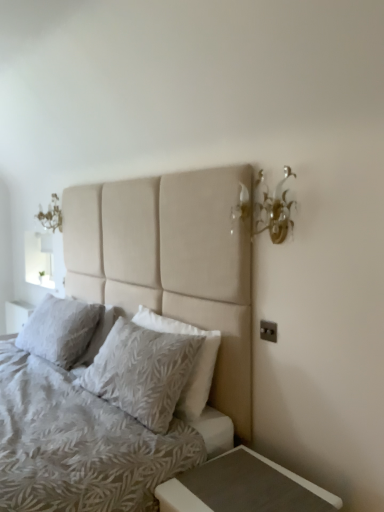
The image size is (384, 512). What do you see at coordinates (171, 263) in the screenshot?
I see `beige fabric bed at center` at bounding box center [171, 263].

Find the location of `beige fabric bed at center`. beige fabric bed at center is located at coordinates (171, 263).

At what (x,y) coordinates should I click in order to perform the action: click on white frosted glass at upper left. Please return your answer as a coordinate pair (x, y). Image resolution: width=384 pixels, height=512 pixels. Looking at the image, I should click on (39, 259).

The height and width of the screenshot is (512, 384). I want to click on white textured pillow at center, acting as the first pillow starting from the left, so click(59, 329).

From a real-world perspective, is matte gray wood nightstand at lower right over matte gray plastic electric outlet at lower right?

No, from a real-world perspective, matte gray wood nightstand at lower right is not over matte gray plastic electric outlet at lower right

Is matte gray wood nightstand at lower right next to matte gray plastic electric outlet at lower right and touching it?

matte gray wood nightstand at lower right is not next to matte gray plastic electric outlet at lower right, and they're not touching.

Consider the image. In the image, is matte gray wood nightstand at lower right on the left side or the right side of matte gray plastic electric outlet at lower right?

matte gray wood nightstand at lower right is positioned on matte gray plastic electric outlet at lower right's left side.

The image size is (384, 512). In order to click on nightstand in front of the matte gray plastic electric outlet at lower right in this screenshot , I will do `click(243, 487)`.

Is matte gray wood nightstand at lower right positioned beyond the bounds of white frosted glass at upper left?

Absolutely, matte gray wood nightstand at lower right is external to white frosted glass at upper left.

Can you confirm if matte gray wood nightstand at lower right is shorter than white frosted glass at upper left?

Indeed, matte gray wood nightstand at lower right has a lesser height compared to white frosted glass at upper left.

I want to click on nightstand on the right of the white frosted glass at upper left, so click(243, 487).

Can you tell me how much matte gray wood nightstand at lower right and white frosted glass at upper left differ in facing direction?

The angular difference between matte gray wood nightstand at lower right and white frosted glass at upper left is 1.22 degrees.

Between gold metallic wall sconce at upper right and white frosted glass at upper left, which one has less height?

gold metallic wall sconce at upper right is shorter.

Which object is positioned more to the left, gold metallic wall sconce at upper right or white frosted glass at upper left?

From the viewer's perspective, white frosted glass at upper left appears more on the left side.

Locate an element on the screen. lamp that is above the white frosted glass at upper left (from a real-world perspective) is located at coordinates (274, 212).

From a real-world perspective, is gold metallic wall sconce at upper right positioned over white frosted glass at upper left based on gravity?

Correct, in the physical world, gold metallic wall sconce at upper right is higher than white frosted glass at upper left.

Is gold metallic wall sconce at upper right not within matte gray plastic electric outlet at lower right?

Indeed, gold metallic wall sconce at upper right is completely outside matte gray plastic electric outlet at lower right.

Is gold metallic wall sconce at upper right positioned far away from matte gray plastic electric outlet at lower right?

No, gold metallic wall sconce at upper right is not far from matte gray plastic electric outlet at lower right.

Looking at this image, from a real-world perspective, is gold metallic wall sconce at upper right located higher than matte gray plastic electric outlet at lower right?

Yes.

Can you confirm if gold metallic wall sconce at upper right is positioned to the right of matte gray plastic electric outlet at lower right?

No.

From the image's perspective, is textured beige pillow at center, placed as the 2th pillow when sorted from left to right, positioned above or below matte gray plastic electric outlet at lower right?

Clearly, from the image's perspective, textured beige pillow at center, placed as the 2th pillow when sorted from left to right, is below matte gray plastic electric outlet at lower right.

Which of these two, textured beige pillow at center, placed as the 2th pillow when sorted from left to right, or matte gray plastic electric outlet at lower right, stands shorter?

With less height is matte gray plastic electric outlet at lower right.

From a real-world perspective, relative to matte gray plastic electric outlet at lower right, is textured beige pillow at center, placed as the 2th pillow when sorted from left to right, vertically above or below?

From a real-world perspective, textured beige pillow at center, placed as the 2th pillow when sorted from left to right, is physically below matte gray plastic electric outlet at lower right.

Is textured beige pillow at center, which appears as the first pillow when viewed from the right, thinner than matte gray plastic electric outlet at lower right?

In fact, textured beige pillow at center, which appears as the first pillow when viewed from the right, might be wider than matte gray plastic electric outlet at lower right.

Is white textured pillow at center, the 2th pillow in the front-to-back sequence, directly adjacent to textured beige pillow at center, which appears as the first pillow when viewed from the right?

white textured pillow at center, the 2th pillow in the front-to-back sequence, and textured beige pillow at center, which appears as the first pillow when viewed from the right, are not in contact.

Is white textured pillow at center, the 2th pillow in the front-to-back sequence, aimed at textured beige pillow at center, which is counted as the first pillow, starting from the front?

No.

Considering the relative sizes of white textured pillow at center, acting as the 1th pillow starting from the back, and textured beige pillow at center, which appears as the first pillow when viewed from the right, in the image provided, is white textured pillow at center, acting as the 1th pillow starting from the back, smaller than textured beige pillow at center, which appears as the first pillow when viewed from the right,?

No.

Is beige fabric bed at center facing towards textured beige pillow at center, marked as the 2th pillow in a back-to-front arrangement?

Yes, beige fabric bed at center faces towards textured beige pillow at center, marked as the 2th pillow in a back-to-front arrangement.

The width and height of the screenshot is (384, 512). I want to click on the 2nd pillow below the beige fabric bed at center (from a real-world perspective), so click(x=142, y=371).

In the scene shown: Can you tell me how much beige fabric bed at center and textured beige pillow at center, which appears as the first pillow when viewed from the right, differ in facing direction?

The angle between the facing direction of beige fabric bed at center and the facing direction of textured beige pillow at center, which appears as the first pillow when viewed from the right, is 1.22 degrees.

From a real-world perspective, between beige fabric bed at center and textured beige pillow at center, placed as the 2th pillow when sorted from left to right, who is vertically higher?

beige fabric bed at center.

Where is `nightstand below the matte gray plastic electric outlet at lower right (from a real-world perspective)`? This screenshot has height=512, width=384. nightstand below the matte gray plastic electric outlet at lower right (from a real-world perspective) is located at coordinates (243, 487).

Identify the location of nightstand below the white frosted glass at upper left (from the image's perspective). Image resolution: width=384 pixels, height=512 pixels. (243, 487).

From the image, which object appears to be farther from gold metallic wall sconce at upper right, matte gray wood nightstand at lower right or textured beige pillow at center, which is counted as the first pillow, starting from the front?

matte gray wood nightstand at lower right is positioned further to the anchor gold metallic wall sconce at upper right.

When comparing their distances from beige fabric bed at center, does white textured pillow at center, the 2th pillow in the front-to-back sequence, or matte gray wood nightstand at lower right seem further?

matte gray wood nightstand at lower right is positioned further to the anchor beige fabric bed at center.

Looking at the image, which one is located closer to gold metallic wall sconce at upper right, white textured pillow at center, the 2th pillow in the front-to-back sequence, or matte gray plastic electric outlet at lower right?

Based on the image, matte gray plastic electric outlet at lower right appears to be nearer to gold metallic wall sconce at upper right.

Considering their positions, is textured beige pillow at center, which is counted as the first pillow, starting from the front, positioned closer to matte gray wood nightstand at lower right than matte gray plastic electric outlet at lower right?

textured beige pillow at center, which is counted as the first pillow, starting from the front, lies closer to matte gray wood nightstand at lower right than the other object.

When comparing their distances from matte gray wood nightstand at lower right, does gold metallic wall sconce at upper right or matte gray plastic electric outlet at lower right seem further?

gold metallic wall sconce at upper right is positioned further to the anchor matte gray wood nightstand at lower right.

Estimate the real-world distances between objects in this image. Which object is further from white textured pillow at center, the 2th pillow in the front-to-back sequence, matte gray plastic electric outlet at lower right or beige fabric bed at center?

Among the two, matte gray plastic electric outlet at lower right is located further to white textured pillow at center, the 2th pillow in the front-to-back sequence.

Which object lies nearer to the anchor point matte gray wood nightstand at lower right, white textured pillow at center, the 2th pillow in the front-to-back sequence, or matte gray plastic electric outlet at lower right?

matte gray plastic electric outlet at lower right is closer to matte gray wood nightstand at lower right.

Looking at the image, which one is located further to gold metallic wall sconce at upper right, beige fabric bed at center or matte gray plastic electric outlet at lower right?

beige fabric bed at center lies further to gold metallic wall sconce at upper right than the other object.

This screenshot has height=512, width=384. Identify the location of lamp positioned between beige fabric bed at center and white textured pillow at center, positioned as the second pillow in right-to-left order, from near to far. (274, 212).

At what (x,y) coordinates should I click in order to perform the action: click on nightstand located between beige fabric bed at center and white frosted glass at upper left in the depth direction. Please return your answer as a coordinate pair (x, y). The image size is (384, 512). Looking at the image, I should click on (243, 487).

Find the location of a particular element. The height and width of the screenshot is (512, 384). electric outlet between beige fabric bed at center and white frosted glass at upper left along the z-axis is located at coordinates (268, 331).

This screenshot has height=512, width=384. I want to click on nightstand between beige fabric bed at center and white textured pillow at center, acting as the first pillow starting from the left, along the z-axis, so click(x=243, y=487).